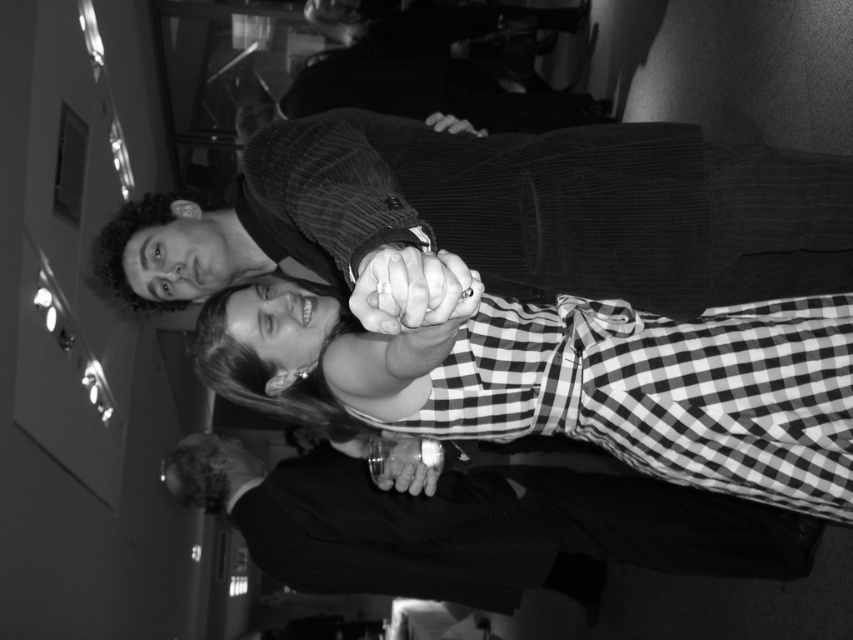
You are at a formal event and see two suits in the image. The corduroy suit at center and the smooth black suit at lower center. Which suit is positioned higher up in the image?

The corduroy suit at center is positioned higher up in the image as it is above the smooth black suit at lower center.

You are a photographer adjusting the focus on a camera. You need to ensure that both the checkered fabric dress at center and the translucent plastic cup at center are in sharp focus. Given their sizes, which object should you set the focus on first to maximize clarity for both?

The checkered fabric dress at center has a larger size compared to the translucent plastic cup at center, so you should focus on the checkered fabric dress at center first to ensure both are in sharp focus.

You are a photographer who needs to adjust the focus of your camera. You have to focus on either the smooth black suit at lower center or the smooth black ring at center. Which object should you choose if you want to capture the larger one in focus?

The smooth black suit at lower center has a larger size compared to the smooth black ring at center, so you should focus on the smooth black suit at lower center to capture the larger one in focus.